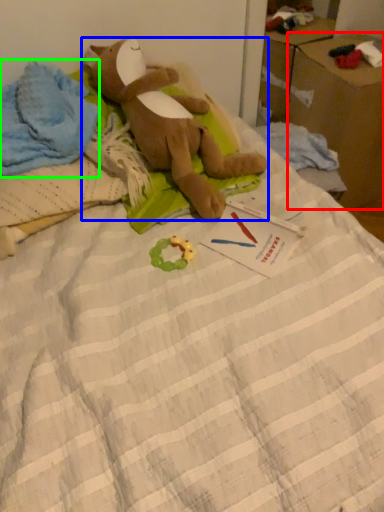
Question: Which object is the farthest from cardboard box (highlighted by a red box)? Choose among these: toy (highlighted by a blue box) or clothing (highlighted by a green box).

Choices:
 (A) toy
 (B) clothing

Answer: (B)